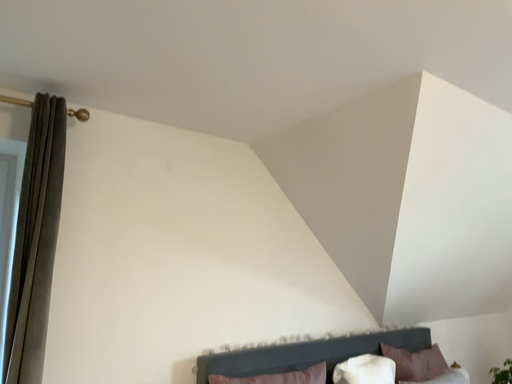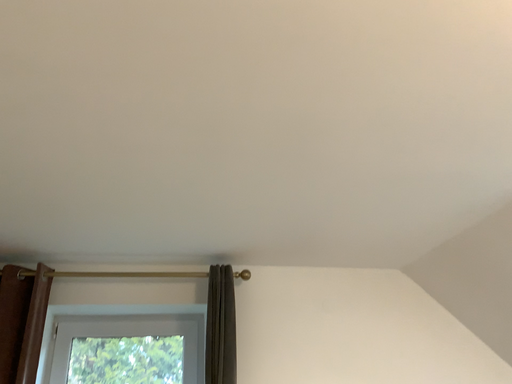
Question: How did the camera likely rotate when shooting the video?

Choices:
 (A) rotated downward
 (B) rotated upward

Answer: (B)